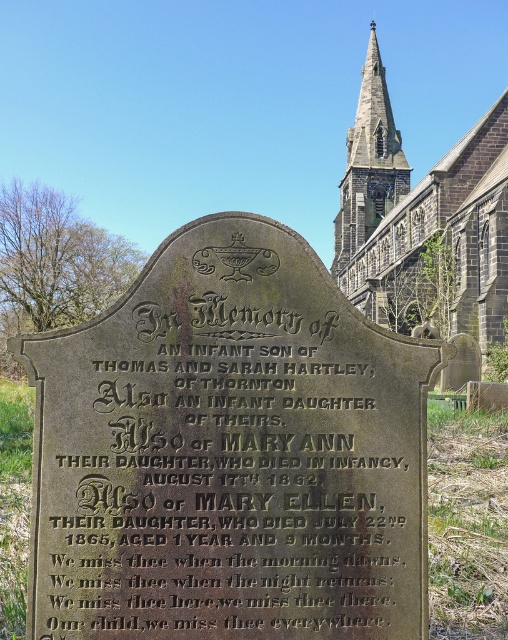
Question: Which point appears farthest from the camera in this image?

Choices:
 (A) (333, 259)
 (B) (365, 262)

Answer: (A)

Question: Does dark gray stone church steeple at upper center lie behind dark gray stone spire at upper center?

Choices:
 (A) yes
 (B) no

Answer: (B)

Question: Is dark gray stone church steeple at upper center wider than dark gray stone spire at upper center?

Choices:
 (A) yes
 (B) no

Answer: (A)

Question: Which object appears farthest from the camera in this image?

Choices:
 (A) dark gray stone inscription at center
 (B) dark gray stone church steeple at upper center

Answer: (B)

Question: Among these points, which one is farthest from the camera?

Choices:
 (A) (121, 448)
 (B) (366, 168)
 (C) (356, 140)

Answer: (C)

Question: Is dark gray stone inscription at center positioned behind dark gray stone spire at upper center?

Choices:
 (A) yes
 (B) no

Answer: (B)